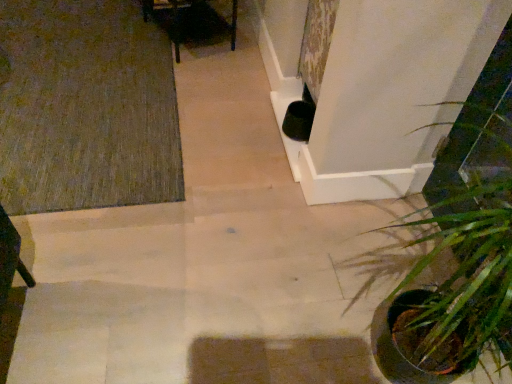
I want to click on green textured rug at upper left, so click(86, 108).

Measure the distance between point [11,199] and camera.

Point [11,199] and camera are 1.63 meters apart from each other.

The height and width of the screenshot is (384, 512). Describe the element at coordinates (86, 108) in the screenshot. I see `green textured rug at upper left` at that location.

Describe the element at coordinates (452, 280) in the screenshot. I see `green leafy plant at lower right` at that location.

Identify the location of green leafy plant at lower right. 452,280.

The image size is (512, 384). I want to click on green textured rug at upper left, so click(x=86, y=108).

Is green leafy plant at lower right at the left side of green textured rug at upper left?

No.

Which object is further away from the camera taking this photo, green leafy plant at lower right or green textured rug at upper left?

green textured rug at upper left is further away from the camera.

Does point (432, 231) come farther from viewer compared to point (66, 179)?

No, (432, 231) is in front of (66, 179).

From the image's perspective, is green leafy plant at lower right above green textured rug at upper left?

No.

From a real-world perspective, is green leafy plant at lower right located higher than green textured rug at upper left?

Indeed, from a real-world perspective, green leafy plant at lower right stands above green textured rug at upper left.

Is green leafy plant at lower right thinner than green textured rug at upper left?

Indeed, green leafy plant at lower right has a lesser width compared to green textured rug at upper left.

Who is shorter, green leafy plant at lower right or green textured rug at upper left?

green textured rug at upper left.

Considering the sizes of objects green leafy plant at lower right and green textured rug at upper left in the image provided, who is smaller, green leafy plant at lower right or green textured rug at upper left?

green textured rug at upper left is smaller.

Does green leafy plant at lower right contain green textured rug at upper left?

That's incorrect, green textured rug at upper left is not inside green leafy plant at lower right.

Is green leafy plant at lower right touching green textured rug at upper left?

No, green leafy plant at lower right is not with green textured rug at upper left.

In the scene shown: Is green leafy plant at lower right looking in the opposite direction of green textured rug at upper left?

green leafy plant at lower right does not have its back to green textured rug at upper left.

Find the location of a particular element. This screenshot has height=384, width=512. doormat below the green leafy plant at lower right (from a real-world perspective) is located at coordinates (86, 108).

Which object is positioned more to the left, green textured rug at upper left or green leafy plant at lower right?

From the viewer's perspective, green textured rug at upper left appears more on the left side.

Who is more distant, green textured rug at upper left or green leafy plant at lower right?

green textured rug at upper left is more distant.

Is point (34, 36) closer to camera compared to point (389, 334)?

No, it is not.

From the image's perspective, does green textured rug at upper left appear lower than green leafy plant at lower right?

No, from the image's perspective, green textured rug at upper left is not beneath green leafy plant at lower right.

From a real-world perspective, is green textured rug at upper left physically below green leafy plant at lower right?

Yes.

Between green textured rug at upper left and green leafy plant at lower right, which one has smaller width?

green leafy plant at lower right is thinner.

In the scene shown: Which of these two, green textured rug at upper left or green leafy plant at lower right, stands taller?

With more height is green leafy plant at lower right.

Considering the relative sizes of green textured rug at upper left and green leafy plant at lower right in the image provided, is green textured rug at upper left bigger than green leafy plant at lower right?

No, green textured rug at upper left is not bigger than green leafy plant at lower right.

Is green textured rug at upper left completely or partially outside of green leafy plant at lower right?

Yes, green textured rug at upper left is not within green leafy plant at lower right.

Is green textured rug at upper left next to green leafy plant at lower right and touching it?

No, green textured rug at upper left is not with green leafy plant at lower right.

Is green textured rug at upper left facing towards green leafy plant at lower right?

No, green textured rug at upper left is not facing towards green leafy plant at lower right.

How much distance is there between green textured rug at upper left and green leafy plant at lower right?

1.25 meters.

Find the location of a particular element. houseplant below the green textured rug at upper left (from the image's perspective) is located at coordinates (452, 280).

Where is `houseplant below the green textured rug at upper left (from the image's perspective)`? The height and width of the screenshot is (384, 512). houseplant below the green textured rug at upper left (from the image's perspective) is located at coordinates (452, 280).

At what (x,y) coordinates should I click in order to perform the action: click on houseplant above the green textured rug at upper left (from a real-world perspective). Please return your answer as a coordinate pair (x, y). The image size is (512, 384). Looking at the image, I should click on (452, 280).